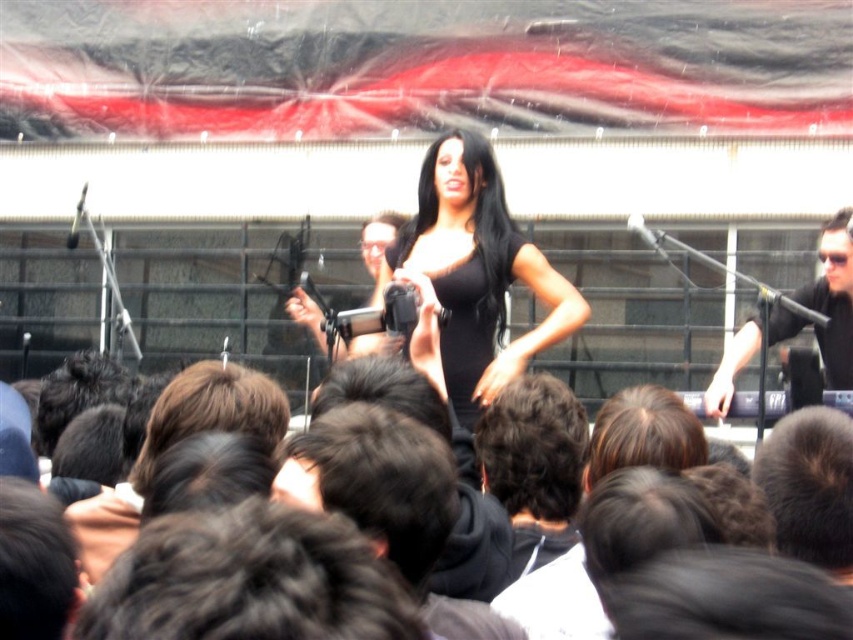
Which is more to the left, matte black microphone at center or metallic silver microphone at upper left?

Positioned to the left is metallic silver microphone at upper left.

Is matte black microphone at center above metallic silver microphone at upper left?

No.

Is point (316, 324) behind point (80, 221)?

No, (316, 324) is in front of (80, 221).

I want to click on matte black microphone at center, so click(379, 250).

Who is positioned more to the left, black matte microphone at right or black shiny hair at center?

black shiny hair at center is more to the left.

The width and height of the screenshot is (853, 640). I want to click on black matte microphone at right, so click(833, 300).

Which is more to the right, black silky hair at center or black shiny hair at center?

black silky hair at center is more to the right.

Is black silky hair at center behind black shiny hair at center?

No, it is in front of black shiny hair at center.

The width and height of the screenshot is (853, 640). What do you see at coordinates (471, 220) in the screenshot?
I see `black silky hair at center` at bounding box center [471, 220].

I want to click on black silky hair at center, so click(x=471, y=220).